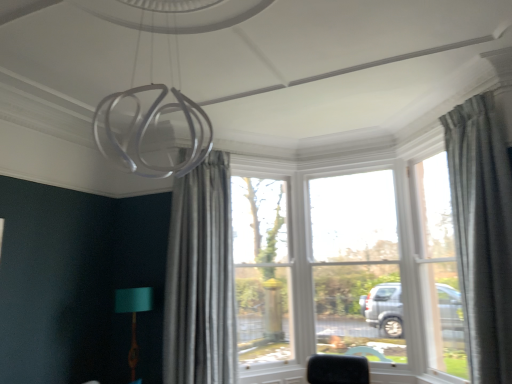
Question: In terms of width, does clear glass window at right, the 1th window when ordered from right to left, look wider or thinner when compared to textured gray curtain at right, marked as the 1th curtain in a front-to-back arrangement?

Choices:
 (A) thin
 (B) wide

Answer: (A)

Question: Is clear glass window at right, the 1th window when ordered from right to left, taller or shorter than textured gray curtain at right, marked as the 1th curtain in a right-to-left arrangement?

Choices:
 (A) short
 (B) tall

Answer: (B)

Question: Which of these objects is positioned closest to the silky gray curtain at center, the 2th curtain positioned from the right?

Choices:
 (A) clear glass window at center, which ranks as the second window in right-to-left order
 (B) clear glass window at right, the 1th window when ordered from right to left
 (C) teal fabric lampshade at lower left
 (D) textured gray curtain at right, the 2th curtain when ordered from back to front

Answer: (C)

Question: Considering the real-world distances, which object is farthest from the clear glass window at center, which ranks as the second window in right-to-left order?

Choices:
 (A) clear glass window at right, the 1th window when ordered from right to left
 (B) silky gray curtain at center, marked as the 1th curtain in a back-to-front arrangement
 (C) teal fabric lampshade at lower left
 (D) textured gray curtain at right, marked as the 1th curtain in a right-to-left arrangement

Answer: (D)